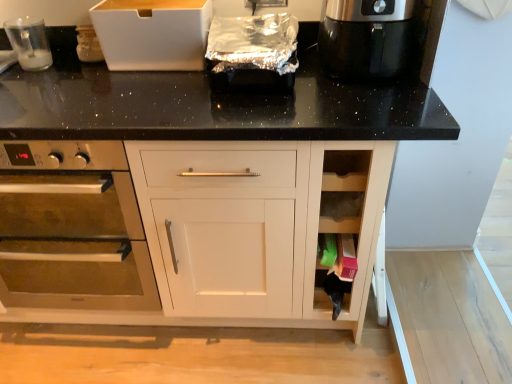
This screenshot has height=384, width=512. Describe the element at coordinates (29, 43) in the screenshot. I see `clear plastic cup at upper left` at that location.

Locate an element on the screen. white cardboard box at upper center is located at coordinates (153, 34).

Locate an element on the screen. stainless steel oven at left is located at coordinates (71, 228).

Find the location of a particular element. The width and height of the screenshot is (512, 384). shiny black coffee maker at upper right is located at coordinates (365, 38).

You are a GUI agent. You are given a task and a screenshot of the screen. Output one action in this format:
    pyautogui.click(x=<x>, y=<y>)
    Task: Click on the clear plastic cup at upper left
    This screenshot has width=512, height=384.
    Given the screenshot: What is the action you would take?
    pyautogui.click(x=29, y=43)

Visually, is white cardboard box at upper center positioned to the left or to the right of stainless steel oven at left?

In the image, white cardboard box at upper center appears on the right side of stainless steel oven at left.

Is white cardboard box at upper center wider or thinner than stainless steel oven at left?

Considering their sizes, white cardboard box at upper center looks slimmer than stainless steel oven at left.

How different are the orientations of white cardboard box at upper center and stainless steel oven at left in degrees?

The facing directions of white cardboard box at upper center and stainless steel oven at left are 1.12 degrees apart.

Locate an element on the screen. The width and height of the screenshot is (512, 384). cardboard box located above the stainless steel oven at left (from the image's perspective) is located at coordinates (153, 34).

Is stainless steel oven at left to the right of shiny black coffee maker at upper right from the viewer's perspective?

No, stainless steel oven at left is not to the right of shiny black coffee maker at upper right.

How different are the orientations of stainless steel oven at left and shiny black coffee maker at upper right in degrees?

1.01 degrees separate the facing orientations of stainless steel oven at left and shiny black coffee maker at upper right.

Considering the relative sizes of stainless steel oven at left and shiny black coffee maker at upper right in the image provided, is stainless steel oven at left thinner than shiny black coffee maker at upper right?

No, stainless steel oven at left is not thinner than shiny black coffee maker at upper right.

Is stainless steel oven at left positioned with its back to shiny black coffee maker at upper right?

No, shiny black coffee maker at upper right is not at the back of stainless steel oven at left.

Between stainless steel oven at left and white cardboard box at upper center, which one appears on the left side from the viewer's perspective?

Positioned to the left is stainless steel oven at left.

Measure the distance between stainless steel oven at left and white cardboard box at upper center.

A distance of 21.51 inches exists between stainless steel oven at left and white cardboard box at upper center.

Is stainless steel oven at left aimed at white cardboard box at upper center?

No.

Is stainless steel oven at left smaller than white cardboard box at upper center?

Actually, stainless steel oven at left might be larger than white cardboard box at upper center.

Does clear plastic cup at upper left come in front of white cardboard box at upper center?

No.

Would you say clear plastic cup at upper left is a long distance from white cardboard box at upper center?

clear plastic cup at upper left is actually quite close to white cardboard box at upper center.

Consider the image. Is white cardboard box at upper center a part of clear plastic cup at upper left?

Definitely not — white cardboard box at upper center is not inside clear plastic cup at upper left.

Between clear plastic cup at upper left and white cardboard box at upper center, which one has more height?

Standing taller between the two is white cardboard box at upper center.

Considering the positions of points (28, 26) and (327, 7), is point (28, 26) closer to camera compared to point (327, 7)?

No, it is not.

From a real-world perspective, is clear plastic cup at upper left positioned under shiny black coffee maker at upper right based on gravity?

Yes.

Is clear plastic cup at upper left located outside shiny black coffee maker at upper right?

Yes, clear plastic cup at upper left is located beyond the bounds of shiny black coffee maker at upper right.

What's the angular difference between clear plastic cup at upper left and shiny black coffee maker at upper right's facing directions?

1.02 degrees.

Does point (15, 32) come behind point (137, 291)?

No, (15, 32) is closer to viewer.

Identify the location of appliance located above the stainless steel oven at left (from a real-world perspective). click(x=29, y=43).

Could you tell me if clear plastic cup at upper left is turned towards stainless steel oven at left?

No.

Considering the relative positions of clear plastic cup at upper left and stainless steel oven at left in the image provided, is clear plastic cup at upper left in front of stainless steel oven at left?

No, it is not.

Is white cardboard box at upper center behind shiny black coffee maker at upper right?

Yes, white cardboard box at upper center is further from the viewer.

Consider the image. From the image's perspective, which object appears higher, white cardboard box at upper center or shiny black coffee maker at upper right?

white cardboard box at upper center.

Is white cardboard box at upper center located outside shiny black coffee maker at upper right?

white cardboard box at upper center lies outside shiny black coffee maker at upper right's area.

Considering the sizes of objects white cardboard box at upper center and shiny black coffee maker at upper right in the image provided, who is bigger, white cardboard box at upper center or shiny black coffee maker at upper right?

With larger size is shiny black coffee maker at upper right.

Where is `cardboard box to the right of stainless steel oven at left`? The width and height of the screenshot is (512, 384). cardboard box to the right of stainless steel oven at left is located at coordinates (153, 34).

Where is `home appliance on the left of shiny black coffee maker at upper right`? Image resolution: width=512 pixels, height=384 pixels. home appliance on the left of shiny black coffee maker at upper right is located at coordinates (71, 228).

From the image, which object appears to be farther from white cardboard box at upper center, stainless steel oven at left or clear plastic cup at upper left?

Among the two, stainless steel oven at left is located further to white cardboard box at upper center.

Looking at the image, which one is located closer to shiny black coffee maker at upper right, clear plastic cup at upper left or white cardboard box at upper center?

Among the two, white cardboard box at upper center is located nearer to shiny black coffee maker at upper right.

Looking at the image, which one is located further to clear plastic cup at upper left, stainless steel oven at left or shiny black coffee maker at upper right?

shiny black coffee maker at upper right lies further to clear plastic cup at upper left than the other object.

Which object lies further to the anchor point stainless steel oven at left, white cardboard box at upper center or clear plastic cup at upper left?

Based on the image, clear plastic cup at upper left appears to be further to stainless steel oven at left.

When comparing their distances from white cardboard box at upper center, does clear plastic cup at upper left or stainless steel oven at left seem closer?

Among the two, clear plastic cup at upper left is located nearer to white cardboard box at upper center.

Estimate the real-world distances between objects in this image. Which object is further from shiny black coffee maker at upper right, white cardboard box at upper center or stainless steel oven at left?

Among the two, stainless steel oven at left is located further to shiny black coffee maker at upper right.

From the image, which object appears to be farther from white cardboard box at upper center, clear plastic cup at upper left or shiny black coffee maker at upper right?

Among the two, shiny black coffee maker at upper right is located further to white cardboard box at upper center.

Looking at the image, which one is located closer to clear plastic cup at upper left, shiny black coffee maker at upper right or stainless steel oven at left?

stainless steel oven at left is positioned closer to the anchor clear plastic cup at upper left.

Where is `home appliance located between clear plastic cup at upper left and shiny black coffee maker at upper right in the left-right direction`? The width and height of the screenshot is (512, 384). home appliance located between clear plastic cup at upper left and shiny black coffee maker at upper right in the left-right direction is located at coordinates (71, 228).

You are a GUI agent. You are given a task and a screenshot of the screen. Output one action in this format:
    pyautogui.click(x=<x>, y=<y>)
    Task: Click on the appliance between white cardboard box at upper center and stainless steel oven at left vertically
    This screenshot has height=384, width=512.
    Given the screenshot: What is the action you would take?
    pyautogui.click(x=29, y=43)

In order to click on cardboard box between clear plastic cup at upper left and shiny black coffee maker at upper right in the horizontal direction in this screenshot , I will do `click(153, 34)`.

The height and width of the screenshot is (384, 512). Find the location of `cardboard box between stainless steel oven at left and shiny black coffee maker at upper right from left to right`. cardboard box between stainless steel oven at left and shiny black coffee maker at upper right from left to right is located at coordinates (153, 34).